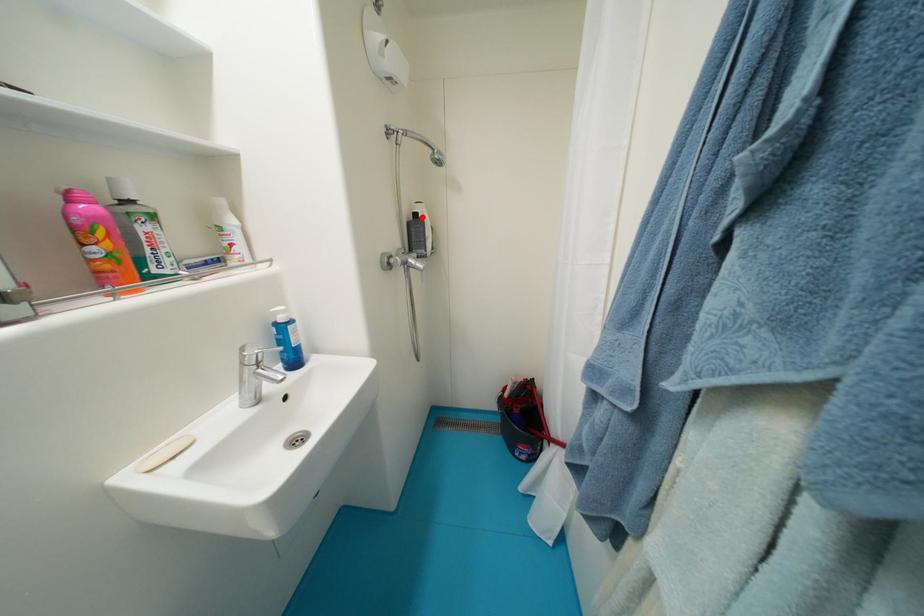
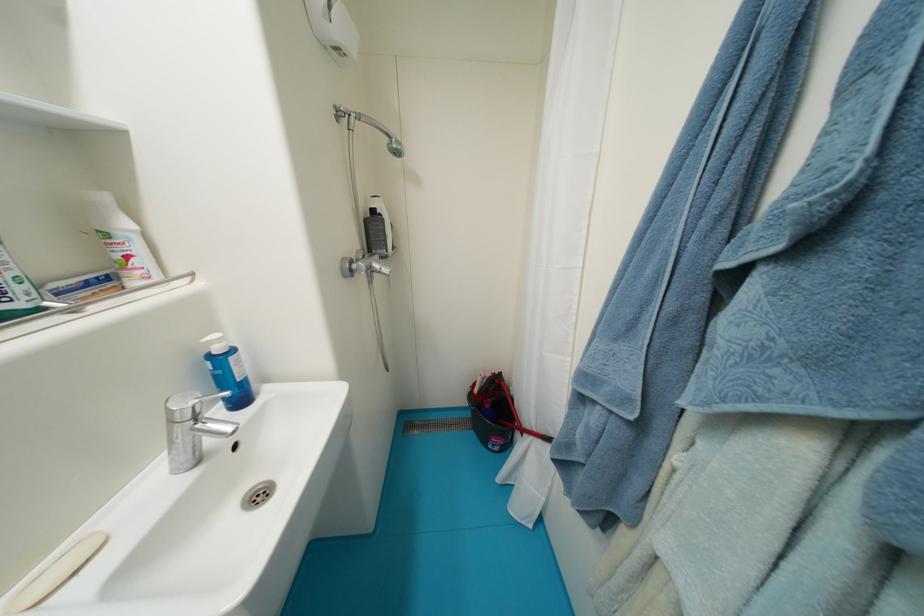
Find the pixel in the second image that matches the highlighted location in the first image.

(380, 214)